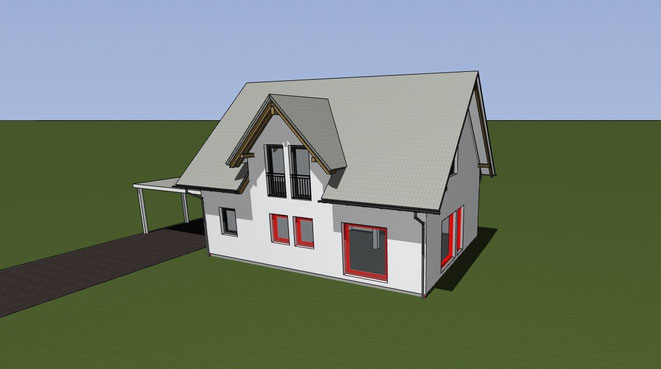
Identify the location of floor. The image size is (661, 369). (355, 243).